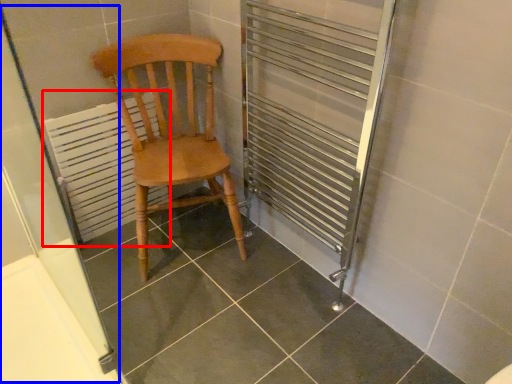
Question: Which point is further to the camera, radiator (highlighted by a red box) or screen door (highlighted by a blue box)?

Choices:
 (A) radiator
 (B) screen door

Answer: (A)